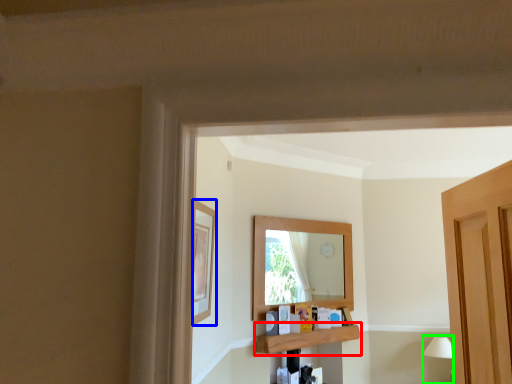
Question: Considering the real-world distances, which object is closest to shelf (highlighted by a red box)? picture frame (highlighted by a blue box) or lamp (highlighted by a green box).

Choices:
 (A) picture frame
 (B) lamp

Answer: (B)